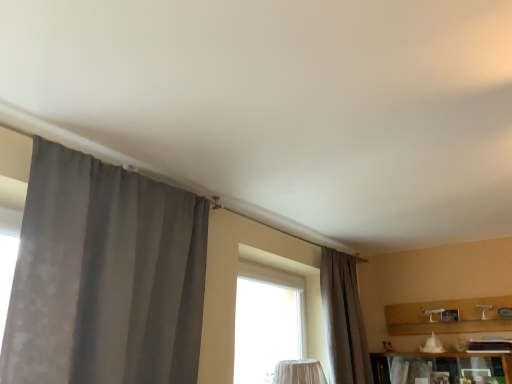
Question: Is gray textured curtain at center, acting as the 1th curtain starting from the right, in front of or behind gray fabric curtain at left, which appears as the 2th curtain when viewed from the right, in the image?

Choices:
 (A) behind
 (B) front

Answer: (A)

Question: Is gray textured curtain at center, positioned as the 2th curtain in front-to-back order, inside or outside of gray fabric curtain at left, which is the 1th curtain in left-to-right order?

Choices:
 (A) outside
 (B) inside

Answer: (A)

Question: Looking at their shapes, would you say gray textured curtain at center, acting as the 1th curtain starting from the right, is wider or thinner than gray fabric curtain at left, which is the 1th curtain in left-to-right order?

Choices:
 (A) wide
 (B) thin

Answer: (B)

Question: Do you think gray fabric curtain at left, which is the 1th curtain in left-to-right order, is within gray textured curtain at center, acting as the 1th curtain starting from the right, or outside of it?

Choices:
 (A) inside
 (B) outside

Answer: (B)

Question: Considering the positions of gray fabric curtain at left, which ranks as the second curtain in back-to-front order, and gray textured curtain at center, arranged as the 1th curtain when viewed from the back, in the image, is gray fabric curtain at left, which ranks as the second curtain in back-to-front order, bigger or smaller than gray textured curtain at center, arranged as the 1th curtain when viewed from the back,?

Choices:
 (A) big
 (B) small

Answer: (A)

Question: From the image's perspective, is gray fabric curtain at left, which is the 1th curtain in left-to-right order, located above or below gray textured curtain at center, the 2th curtain from the left?

Choices:
 (A) below
 (B) above

Answer: (B)

Question: Is point (8, 312) closer or farther from the camera than point (364, 331)?

Choices:
 (A) farther
 (B) closer

Answer: (B)